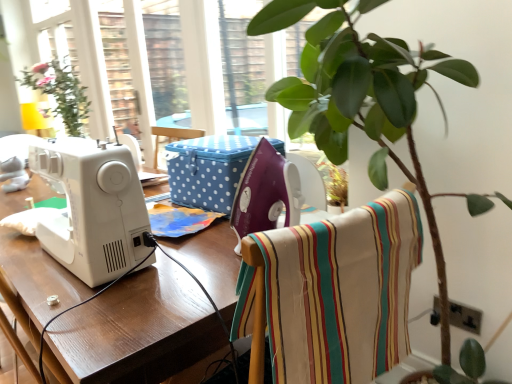
The width and height of the screenshot is (512, 384). What do you see at coordinates (366, 101) in the screenshot?
I see `green glossy houseplant at upper right` at bounding box center [366, 101].

This screenshot has width=512, height=384. What do you see at coordinates (265, 193) in the screenshot? I see `white plastic sewing machine at center, placed as the first sewing machine when sorted from right to left` at bounding box center [265, 193].

What are the coordinates of `blue polka dot fabric box at center` in the screenshot? It's located at (208, 170).

At what (x,y) coordinates should I click in order to perform the action: click on striped cotton fabric at center. Please return your answer as a coordinate pair (x, y). The height and width of the screenshot is (384, 512). Looking at the image, I should click on (336, 292).

Identify the location of white glossy sewing machine at left. The height and width of the screenshot is (384, 512). click(138, 329).

From the picture: From a real-world perspective, which is physically below, blue polka dot fabric box at center or white glossy sewing machine at left?

In real-world perspective, white glossy sewing machine at left is lower.

How far apart are blue polka dot fabric box at center and white glossy sewing machine at left?

They are 30.02 centimeters apart.

Is blue polka dot fabric box at center facing away from white glossy sewing machine at left?

No, blue polka dot fabric box at center's orientation is not away from white glossy sewing machine at left.

Does point (200, 207) appear closer or farther from the camera than point (182, 368)?

Point (200, 207) appears to be farther away from the viewer than point (182, 368).

Is white glossy sewing machine at left at the back of white plastic sewing machine at center, placed as the first sewing machine when sorted from right to left?

white plastic sewing machine at center, placed as the first sewing machine when sorted from right to left, is not turned away from white glossy sewing machine at left.

Consider the image. Is white plastic sewing machine at center, placed as the first sewing machine when sorted from right to left, smaller than white glossy sewing machine at left?

Indeed, white plastic sewing machine at center, placed as the first sewing machine when sorted from right to left, has a smaller size compared to white glossy sewing machine at left.

How far apart are white plastic sewing machine at center, placed as the first sewing machine when sorted from right to left, and white glossy sewing machine at left?

white plastic sewing machine at center, placed as the first sewing machine when sorted from right to left, is 9.30 inches away from white glossy sewing machine at left.

Does white plastic sewing machine at center, which is counted as the 2th sewing machine, starting from the left, appear on the right side of white glossy sewing machine at left?

Correct, you'll find white plastic sewing machine at center, which is counted as the 2th sewing machine, starting from the left, to the right of white glossy sewing machine at left.

Looking at their sizes, would you say white glossy sewing machine at left is wider or thinner than striped cotton fabric at center?

In the image, white glossy sewing machine at left appears to be wider than striped cotton fabric at center.

Which is closer, (206,233) or (359,347)?

Point (206,233).

Is white glossy sewing machine at left in front of striped cotton fabric at center?

No, white glossy sewing machine at left is further to the viewer.

Between white plastic sewing machine at left, the first sewing machine positioned from the left, and white plastic sewing machine at center, which is counted as the 2th sewing machine, starting from the left, which one appears on the left side from the viewer's perspective?

Positioned to the left is white plastic sewing machine at left, the first sewing machine positioned from the left.

Considering the points (108, 157) and (274, 214), which point is in front, point (108, 157) or point (274, 214)?

Positioned in front is point (108, 157).

Can blue polka dot fabric box at center be found inside green glossy houseplant at upper right?

Yes, blue polka dot fabric box at center can be found within green glossy houseplant at upper right.

Visually, is green glossy houseplant at upper right positioned to the left or to the right of blue polka dot fabric box at center?

In the image, green glossy houseplant at upper right appears on the right side of blue polka dot fabric box at center.

Between green glossy houseplant at upper right and blue polka dot fabric box at center, which one has smaller size?

blue polka dot fabric box at center.

Is green glossy houseplant at upper right wider or thinner than blue polka dot fabric box at center?

Considering their sizes, green glossy houseplant at upper right looks broader than blue polka dot fabric box at center.

Does point (166, 345) come in front of point (272, 149)?

Yes, it is in front of point (272, 149).

From a real-world perspective, who is located lower, white glossy sewing machine at left or white plastic sewing machine at center, which is counted as the 2th sewing machine, starting from the left?

In real-world perspective, white glossy sewing machine at left is lower.

Is blue polka dot fabric box at center far away from striped cotton fabric at center?

No.

From a real-world perspective, relative to striped cotton fabric at center, is blue polka dot fabric box at center vertically above or below?

In terms of real-world spatial position, blue polka dot fabric box at center is above striped cotton fabric at center.

Is blue polka dot fabric box at center bigger than striped cotton fabric at center?

No, blue polka dot fabric box at center is not bigger than striped cotton fabric at center.

How distant is blue polka dot fabric box at center from striped cotton fabric at center?

blue polka dot fabric box at center and striped cotton fabric at center are 18.53 inches apart from each other.

Where is `box above the white glossy sewing machine at left (from the image's perspective)`? Image resolution: width=512 pixels, height=384 pixels. box above the white glossy sewing machine at left (from the image's perspective) is located at coordinates (208, 170).

Where is `the 1st sewing machine directly above the white glossy sewing machine at left (from a real-world perspective)`? The width and height of the screenshot is (512, 384). the 1st sewing machine directly above the white glossy sewing machine at left (from a real-world perspective) is located at coordinates (265, 193).

Which object lies nearer to the anchor point blue polka dot fabric box at center, white plastic sewing machine at left, the first sewing machine positioned from the left, or green glossy houseplant at upper right?

Based on the image, white plastic sewing machine at left, the first sewing machine positioned from the left, appears to be nearer to blue polka dot fabric box at center.

Looking at the image, which one is located further to striped cotton fabric at center, blue polka dot fabric box at center or white plastic sewing machine at center, placed as the first sewing machine when sorted from right to left?

blue polka dot fabric box at center is positioned further to the anchor striped cotton fabric at center.

Considering their positions, is striped cotton fabric at center positioned further to white plastic sewing machine at center, placed as the first sewing machine when sorted from right to left, than green glossy houseplant at upper right?

green glossy houseplant at upper right is positioned further to the anchor white plastic sewing machine at center, placed as the first sewing machine when sorted from right to left.

From the image, which object appears to be farther from white plastic sewing machine at center, placed as the first sewing machine when sorted from right to left, white glossy sewing machine at left or blue polka dot fabric box at center?

The object further to white plastic sewing machine at center, placed as the first sewing machine when sorted from right to left, is blue polka dot fabric box at center.

Which object lies nearer to the anchor point white plastic sewing machine at left, the second sewing machine viewed from the right, blue polka dot fabric box at center or white plastic sewing machine at center, placed as the first sewing machine when sorted from right to left?

Based on the image, white plastic sewing machine at center, placed as the first sewing machine when sorted from right to left, appears to be nearer to white plastic sewing machine at left, the second sewing machine viewed from the right.

When comparing their distances from green glossy houseplant at upper right, does white plastic sewing machine at center, which is counted as the 2th sewing machine, starting from the left, or blue polka dot fabric box at center seem closer?

Based on the image, blue polka dot fabric box at center appears to be nearer to green glossy houseplant at upper right.

In the scene shown: Estimate the real-world distances between objects in this image. Which object is further from white glossy sewing machine at left, blue polka dot fabric box at center or striped cotton fabric at center?

blue polka dot fabric box at center lies further to white glossy sewing machine at left than the other object.

When comparing their distances from striped cotton fabric at center, does blue polka dot fabric box at center or green glossy houseplant at upper right seem closer?

Among the two, green glossy houseplant at upper right is located nearer to striped cotton fabric at center.

Where is `sewing machine located between white plastic sewing machine at left, the second sewing machine viewed from the right, and striped cotton fabric at center in the left-right direction`? sewing machine located between white plastic sewing machine at left, the second sewing machine viewed from the right, and striped cotton fabric at center in the left-right direction is located at coordinates (265, 193).

The width and height of the screenshot is (512, 384). I want to click on sewing machine situated between white plastic sewing machine at left, the second sewing machine viewed from the right, and green glossy houseplant at upper right from left to right, so click(x=265, y=193).

At what (x,y) coordinates should I click in order to perform the action: click on blanket between white plastic sewing machine at left, the first sewing machine positioned from the left, and green glossy houseplant at upper right, in the horizontal direction. Please return your answer as a coordinate pair (x, y). The height and width of the screenshot is (384, 512). Looking at the image, I should click on (336, 292).

At what (x,y) coordinates should I click in order to perform the action: click on sewing machine situated between white glossy sewing machine at left and white plastic sewing machine at center, which is counted as the 2th sewing machine, starting from the left, from left to right. Please return your answer as a coordinate pair (x, y). Looking at the image, I should click on (92, 208).